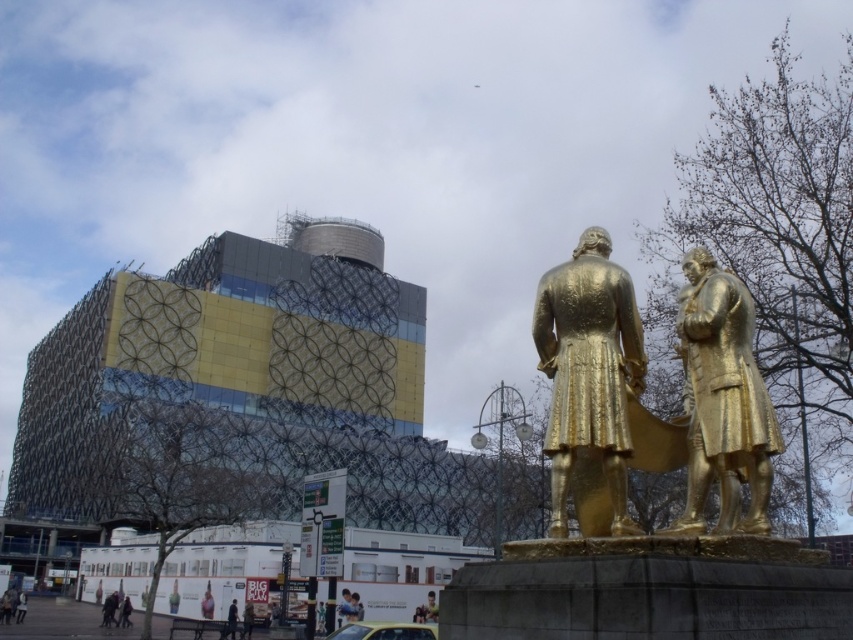
Who is shorter, dark brown leather jacket at lower left or smooth pink dress at lower center?

Standing shorter between the two is smooth pink dress at lower center.

Between dark brown leather jacket at lower left and smooth pink dress at lower center, which one has more height?

dark brown leather jacket at lower left

Identify the location of dark brown leather jacket at lower left. (109, 609).

Identify the location of dark brown leather jacket at lower left. (109, 609).

Does point (627, 531) lie behind point (428, 618)?

No, it is not.

Does gold metallic statue at center have a lesser width compared to golden statue at center?

Incorrect, gold metallic statue at center's width is not less than golden statue at center's.

This screenshot has height=640, width=853. In order to click on gold metallic statue at center in this screenshot , I will do `click(589, 371)`.

Does dark blue jeans at lower center lie behind light brown leather jacket at lower left?

No, dark blue jeans at lower center is closer to the viewer.

Locate an element on the screen. dark blue jeans at lower center is located at coordinates (231, 620).